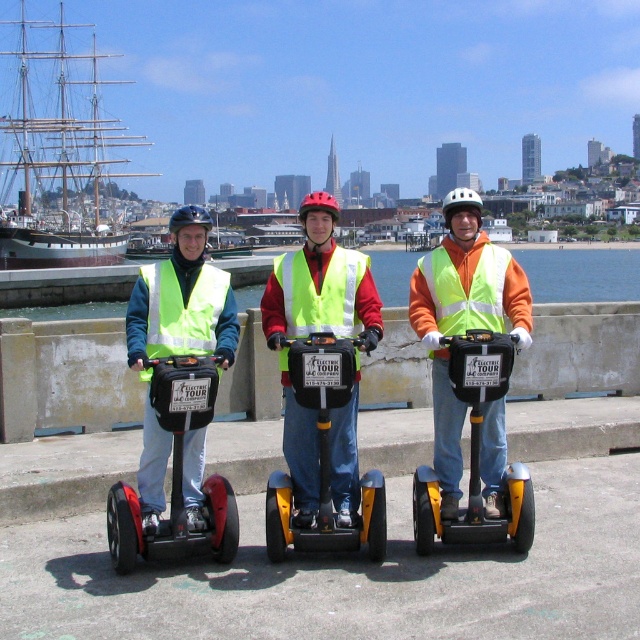
The image size is (640, 640). What do you see at coordinates (180, 300) in the screenshot?
I see `matte yellow vest at center` at bounding box center [180, 300].

Which is in front, point (156, 484) or point (346, 548)?

Point (346, 548)

Which is in front, point (132, 364) or point (332, 376)?

Point (332, 376) is more forward.

Locate an element on the screen. This screenshot has height=640, width=640. matte yellow vest at center is located at coordinates (180, 300).

Between point (330, 513) and point (216, 300), which one is positioned in front?

Point (330, 513) is in front.

Which is behind, point (380, 518) or point (168, 330)?

The point (168, 330) is behind.

The image size is (640, 640). Identify the location of yellow matte segway at center. (323, 458).

Is black rubber scooter at center thinner than blue water at center?

Yes, black rubber scooter at center is thinner than blue water at center.

Which of these two, black rubber scooter at center or blue water at center, stands taller?

blue water at center is taller.

What are the coordinates of `black rubber scooter at center` in the screenshot? It's located at (177, 474).

Locate an element on the screen. This screenshot has height=640, width=640. black rubber scooter at center is located at coordinates (177, 474).